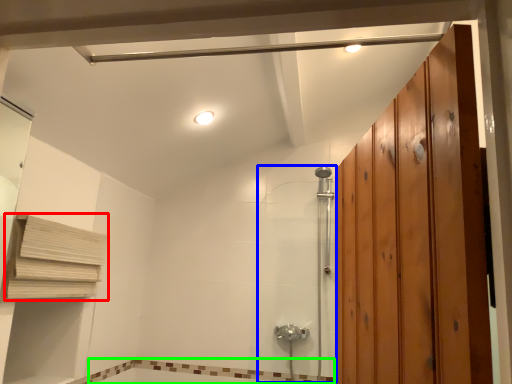
Question: Estimate the real-world distances between objects in this image. Which object is farther from shelf (highlighted by a red box), shower door (highlighted by a blue box) or bath (highlighted by a green box)?

Choices:
 (A) shower door
 (B) bath

Answer: (A)